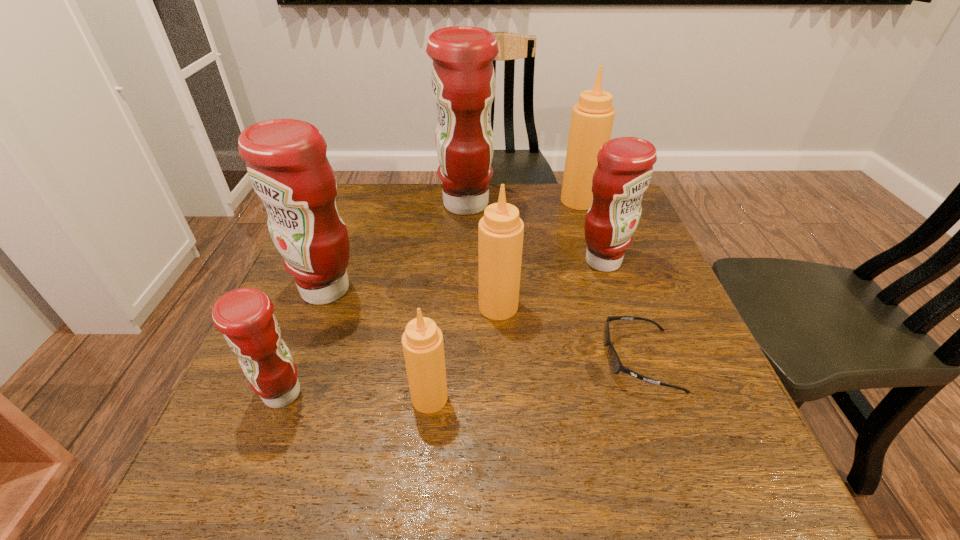
This screenshot has width=960, height=540. I want to click on the nearest tan condiment, so click(422, 341).

The height and width of the screenshot is (540, 960). I want to click on gray sunglasses, so click(x=615, y=363).

Where is `the shortest object`? The image size is (960, 540). the shortest object is located at coordinates (615, 363).

Where is `vacant space located 0.200m on the front of the third red condiment from left to right`? Image resolution: width=960 pixels, height=540 pixels. vacant space located 0.200m on the front of the third red condiment from left to right is located at coordinates (463, 275).

Identify the location of vacant region located on the left of the farthest tan condiment. This screenshot has height=540, width=960. (486, 200).

At what (x,y) coordinates should I click in order to perform the action: click on vacant space located on the right of the second biggest red condiment. Please return your answer as a coordinate pair (x, y). The width and height of the screenshot is (960, 540). Looking at the image, I should click on (516, 289).

What are the coordinates of `free space located 0.320m on the back of the second nearest tan condiment` in the screenshot? It's located at (494, 215).

Locate an element on the screen. This screenshot has height=540, width=960. vacant space situated on the left of the rightmost red condiment is located at coordinates (491, 261).

You are a GUI agent. You are given a task and a screenshot of the screen. Output one action in this format:
    pyautogui.click(x=<x>, y=<y>)
    Task: Click on the blank area located 0.080m on the front of the nearest red condiment
    
    Given the screenshot: What is the action you would take?
    pyautogui.click(x=254, y=464)

Locate an element on the screen. Image resolution: width=960 pixels, height=540 pixels. vacant area situated 0.190m on the left of the leftmost tan condiment is located at coordinates [306, 398].